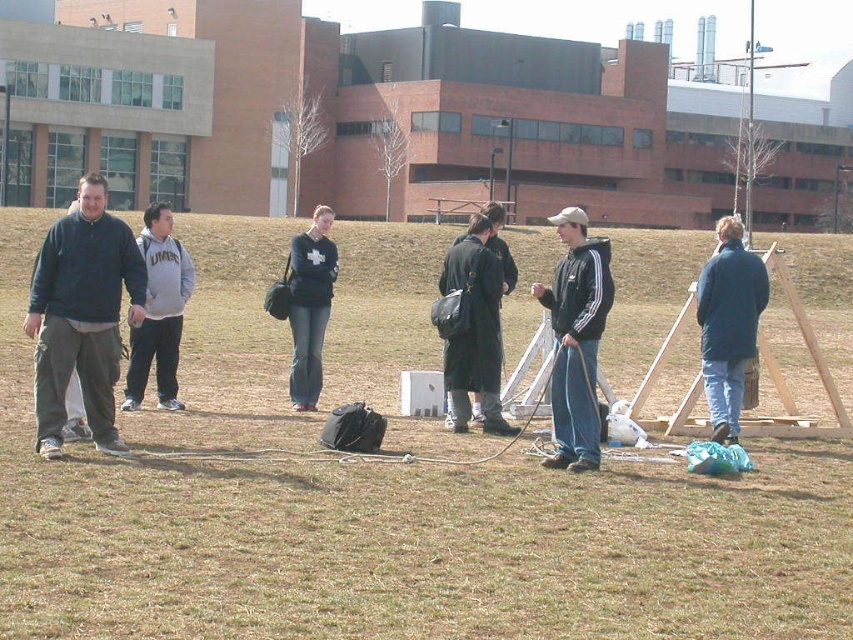
Question: Which object is the closest to the gray fleece sweatshirt at left?

Choices:
 (A) dark blue jacket at center
 (B) brown dry grass at center
 (C) dark gray coat at center

Answer: (C)

Question: Which point appears farthest from the camera in this image?

Choices:
 (A) (491, 323)
 (B) (561, 269)
 (C) (71, 262)
 (D) (0, 241)

Answer: (D)

Question: In this image, where is dark gray coat at center located relative to gray fleece sweatshirt at left?

Choices:
 (A) above
 (B) below

Answer: (B)

Question: Among these objects, which one is farthest from the camera?

Choices:
 (A) brown dry grass at center
 (B) gray fleece sweatshirt at left

Answer: (B)

Question: Is dark blue jacket at center below dark gray coat at center?

Choices:
 (A) yes
 (B) no

Answer: (B)

Question: Is dark blue fleece at left thinner than matte black jacket at center?

Choices:
 (A) yes
 (B) no

Answer: (B)